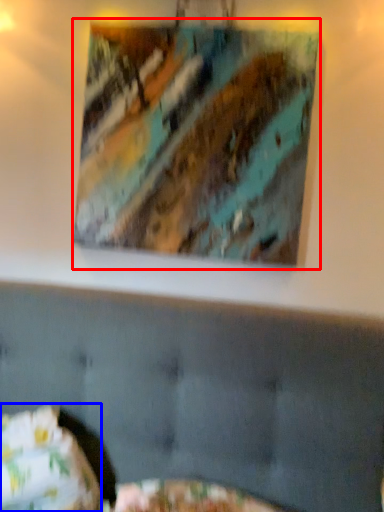
Question: Which point is further to the camera, picture frame (highlighted by a red box) or pillow (highlighted by a blue box)?

Choices:
 (A) picture frame
 (B) pillow

Answer: (A)